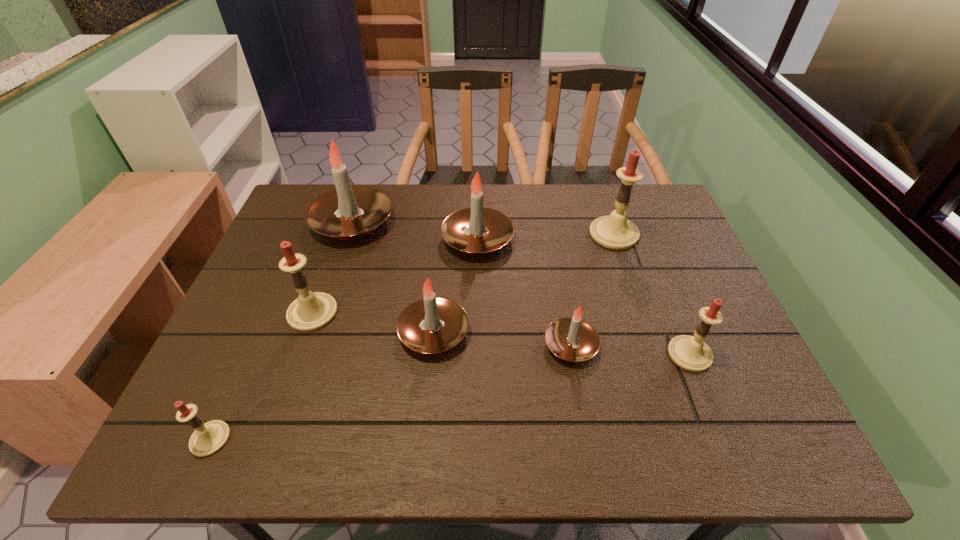
I want to click on object positioned at the far left corner, so click(x=349, y=212).

In order to click on object positioned at the near left corner in this screenshot , I will do `click(208, 438)`.

The image size is (960, 540). In order to click on object at the far right corner in this screenshot , I will do `click(616, 232)`.

The image size is (960, 540). In order to click on free space at the far edge of the desktop in this screenshot , I will do `click(548, 202)`.

Image resolution: width=960 pixels, height=540 pixels. In the image, there is a desktop. Find the location of `vacant region at the near edge`. vacant region at the near edge is located at coordinates (322, 431).

In the image, there is a desktop. Identify the location of vacant area at the left edge. The height and width of the screenshot is (540, 960). (243, 361).

At what (x,y) coordinates should I click in order to perform the action: click on blank space at the right edge of the desktop. Please return your answer as a coordinate pair (x, y). Looking at the image, I should click on (740, 374).

The width and height of the screenshot is (960, 540). I want to click on free space between the third red candle from right to left and the third biggest white candle, so click(373, 322).

Find the location of `free space between the smallest white candle and the second smallest white candle`. free space between the smallest white candle and the second smallest white candle is located at coordinates (502, 339).

At what (x,y) coordinates should I click in order to perform the action: click on unoccupied area between the smallest white candle and the biggest white candle. Please return your answer as a coordinate pair (x, y). This screenshot has height=540, width=960. Looking at the image, I should click on (462, 284).